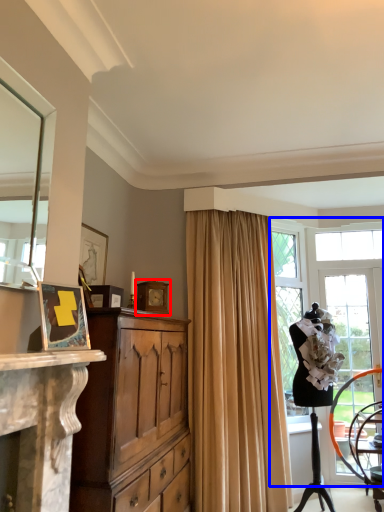
Question: Which object appears farthest to the camera in this image, picture frame (highlighted by a red box) or window (highlighted by a blue box)?

Choices:
 (A) picture frame
 (B) window

Answer: (A)